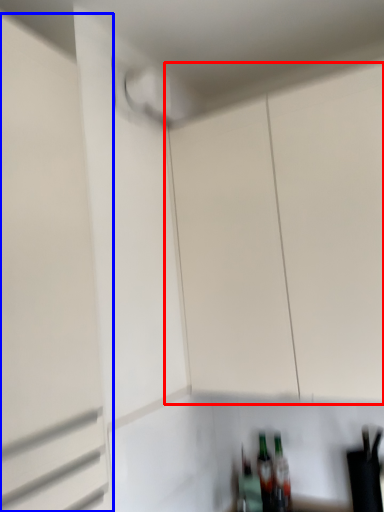
Question: Among these objects, which one is nearest to the camera, cabinetry (highlighted by a red box) or garage door (highlighted by a blue box)?

Choices:
 (A) cabinetry
 (B) garage door

Answer: (B)